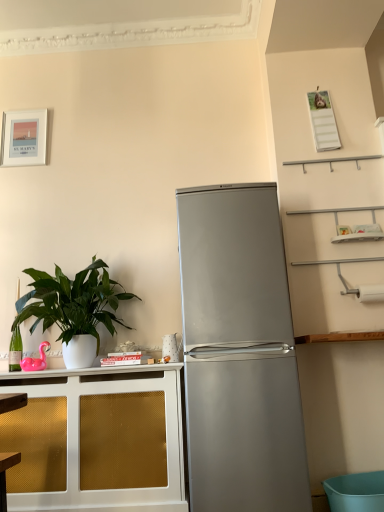
In order to face matte white picture frame at upper left, should I rotate leftwards or rightwards?

To align with it, rotate left about 21.511°.

What is the approximate width of silver metallic refrigerator at center?

4.05 inches.

Image resolution: width=384 pixels, height=512 pixels. What do you see at coordinates (172, 348) in the screenshot?
I see `silver metallic refrigerator at center` at bounding box center [172, 348].

Locate an element on the screen. This screenshot has height=512, width=384. gold mesh cabinet at left is located at coordinates (96, 440).

Considering the positions of points (160, 429) and (179, 345), is point (160, 429) closer to camera compared to point (179, 345)?

Yes.

Is silver metallic refrigerator at center at the back of gold mesh cabinet at left?

That's not correct — gold mesh cabinet at left is not looking away from silver metallic refrigerator at center.

From the image's perspective, is gold mesh cabinet at left above or below silver metallic refrigerator at center?

Clearly, from the image's perspective, gold mesh cabinet at left is below silver metallic refrigerator at center.

Who is shorter, gold mesh cabinet at left or silver metallic refrigerator at center?

Standing shorter between the two is silver metallic refrigerator at center.

Does gold mesh cabinet at left appear on the right side of matte white picture frame at upper left?

Correct, you'll find gold mesh cabinet at left to the right of matte white picture frame at upper left.

From the image's perspective, between gold mesh cabinet at left and matte white picture frame at upper left, which one is located above?

From the image's view, matte white picture frame at upper left is above.

How much distance is there between gold mesh cabinet at left and matte white picture frame at upper left?

gold mesh cabinet at left is 5.85 feet from matte white picture frame at upper left.

Does point (27, 375) appear closer or farther from the camera than point (45, 120)?

Point (27, 375) is positioned closer to the camera compared to point (45, 120).

Considering their positions, is green glossy plant at left located in front of or behind gold mesh cabinet at left?

Visually, green glossy plant at left is located behind gold mesh cabinet at left.

What's the angular difference between green glossy plant at left and gold mesh cabinet at left's facing directions?

The angle between the facing direction of green glossy plant at left and the facing direction of gold mesh cabinet at left is 2.19e-05 degrees.

Is point (38, 294) less distant than point (18, 487)?

No, it is not.

In terms of size, does gold mesh cabinet at left appear bigger or smaller than satin silver refrigerator at center?

Considering their sizes, gold mesh cabinet at left takes up less space than satin silver refrigerator at center.

In the image, there is a satin silver refrigerator at center. Where is `cabinetry below it (from the image's perspective)`? This screenshot has height=512, width=384. cabinetry below it (from the image's perspective) is located at coordinates (96, 440).

From the image's perspective, is gold mesh cabinet at left on satin silver refrigerator at center?

Incorrect, from the image's perspective, gold mesh cabinet at left is lower than satin silver refrigerator at center.

From a real-world perspective, is gold mesh cabinet at left on satin silver refrigerator at center?

Incorrect, from a real-world perspective, gold mesh cabinet at left is lower than satin silver refrigerator at center.

Is green glossy plant at left smaller than matte white picture frame at upper left?

Actually, green glossy plant at left might be larger than matte white picture frame at upper left.

Visually, is green glossy plant at left positioned to the left or to the right of matte white picture frame at upper left?

green glossy plant at left is positioned on matte white picture frame at upper left's right side.

Considering the positions of objects green glossy plant at left and matte white picture frame at upper left in the image provided, who is behind, green glossy plant at left or matte white picture frame at upper left?

Positioned behind is matte white picture frame at upper left.

Is green glossy plant at left looking in the opposite direction of matte white picture frame at upper left?

No, green glossy plant at left is not facing the opposite direction of matte white picture frame at upper left.

Considering the relative sizes of satin silver refrigerator at center and silver metallic refrigerator at center in the image provided, is satin silver refrigerator at center thinner than silver metallic refrigerator at center?

No.

Does satin silver refrigerator at center have a smaller size compared to silver metallic refrigerator at center?

No.

Does satin silver refrigerator at center contain silver metallic refrigerator at center?

Definitely not — silver metallic refrigerator at center is not inside satin silver refrigerator at center.

Is satin silver refrigerator at center at the right side of silver metallic refrigerator at center?

Indeed, satin silver refrigerator at center is positioned on the right side of silver metallic refrigerator at center.

From a real-world perspective, is silver metallic refrigerator at center located higher than matte white picture frame at upper left?

No, from a real-world perspective, silver metallic refrigerator at center is not above matte white picture frame at upper left.

Do you think silver metallic refrigerator at center is within matte white picture frame at upper left, or outside of it?

silver metallic refrigerator at center is outside matte white picture frame at upper left.

Looking at this image, is silver metallic refrigerator at center looking in the opposite direction of matte white picture frame at upper left?

That's not correct — silver metallic refrigerator at center is not looking away from matte white picture frame at upper left.

Locate an element on the screen. cabinetry in front of the silver metallic refrigerator at center is located at coordinates (96, 440).

Find the location of a particular element. This screenshot has width=384, height=512. picture frame above the gold mesh cabinet at left (from the image's perspective) is located at coordinates (23, 138).

From the image, which object appears to be nearer to matte white picture frame at upper left, silver metallic refrigerator at center or satin silver refrigerator at center?

Among the two, silver metallic refrigerator at center is located nearer to matte white picture frame at upper left.

When comparing their distances from satin silver refrigerator at center, does green glossy plant at left or silver metallic refrigerator at center seem closer?

The object closer to satin silver refrigerator at center is silver metallic refrigerator at center.

Estimate the real-world distances between objects in this image. Which object is further from satin silver refrigerator at center, silver metallic refrigerator at center or matte white picture frame at upper left?

matte white picture frame at upper left is positioned further to the anchor satin silver refrigerator at center.

When comparing their distances from matte white picture frame at upper left, does satin silver refrigerator at center or gold mesh cabinet at left seem further?

Based on the image, gold mesh cabinet at left appears to be further to matte white picture frame at upper left.

Estimate the real-world distances between objects in this image. Which object is further from silver metallic refrigerator at center, satin silver refrigerator at center or green glossy plant at left?

The object further to silver metallic refrigerator at center is satin silver refrigerator at center.

Based on their spatial positions, is green glossy plant at left or matte white picture frame at upper left further from satin silver refrigerator at center?

Based on the image, matte white picture frame at upper left appears to be further to satin silver refrigerator at center.

When comparing their distances from matte white picture frame at upper left, does satin silver refrigerator at center or green glossy plant at left seem further?

satin silver refrigerator at center.

Based on their spatial positions, is gold mesh cabinet at left or satin silver refrigerator at center closer to green glossy plant at left?

Among the two, gold mesh cabinet at left is located nearer to green glossy plant at left.

Locate an element on the screen. This screenshot has width=384, height=512. appliance situated between gold mesh cabinet at left and satin silver refrigerator at center from left to right is located at coordinates (172, 348).

In order to click on refrigerator between matte white picture frame at upper left and gold mesh cabinet at left in the vertical direction in this screenshot , I will do `click(239, 353)`.

Where is `houseplant between matte white picture frame at upper left and silver metallic refrigerator at center vertically`? This screenshot has width=384, height=512. houseplant between matte white picture frame at upper left and silver metallic refrigerator at center vertically is located at coordinates (74, 308).

Where is `houseplant between matte white picture frame at upper left and gold mesh cabinet at left from top to bottom`? This screenshot has width=384, height=512. houseplant between matte white picture frame at upper left and gold mesh cabinet at left from top to bottom is located at coordinates (74, 308).